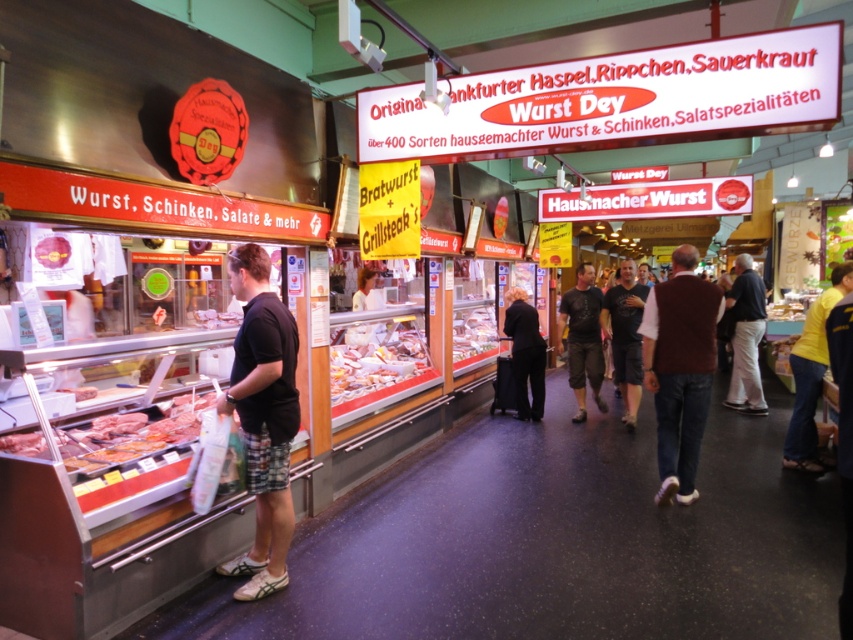
Which is in front, point (740, 308) or point (486, 349)?

Positioned in front is point (740, 308).

The height and width of the screenshot is (640, 853). In order to click on brown fabric pants at center in this screenshot , I will do `click(746, 339)`.

Can you confirm if raw meat at lower left is positioned below brown fabric pants at center?

Yes.

Measure the distance between raw meat at lower left and camera.

They are 10.78 feet apart.

Is point (86, 472) closer to camera compared to point (762, 300)?

Yes.

Locate an element on the screen. raw meat at lower left is located at coordinates (132, 433).

Can you confirm if raw meat at lower left is positioned above dark brown t-shirt at center?

No.

The width and height of the screenshot is (853, 640). Describe the element at coordinates (132, 433) in the screenshot. I see `raw meat at lower left` at that location.

Does point (187, 436) come behind point (599, 364)?

No, (187, 436) is closer to viewer.

At what (x,y) coordinates should I click in order to perform the action: click on raw meat at lower left. Please return your answer as a coordinate pair (x, y). The image size is (853, 640). Looking at the image, I should click on (132, 433).